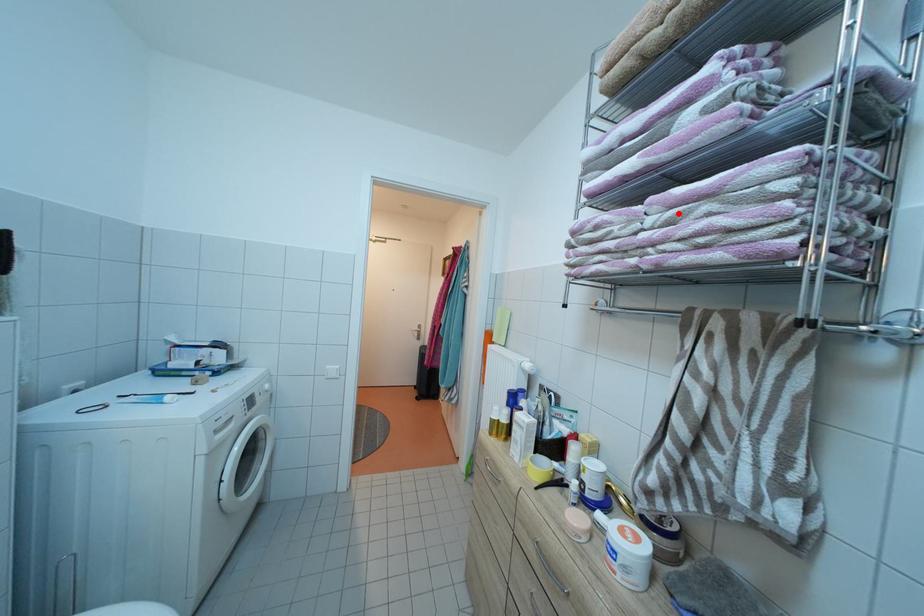
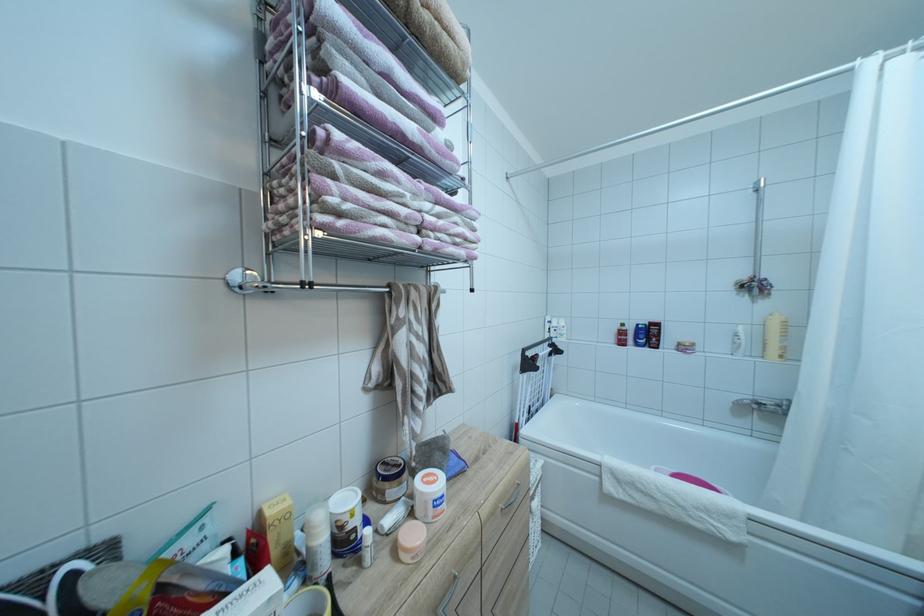
The point at the highlighted location is marked in the first image. Where is the corresponding point in the second image?

(444, 209)